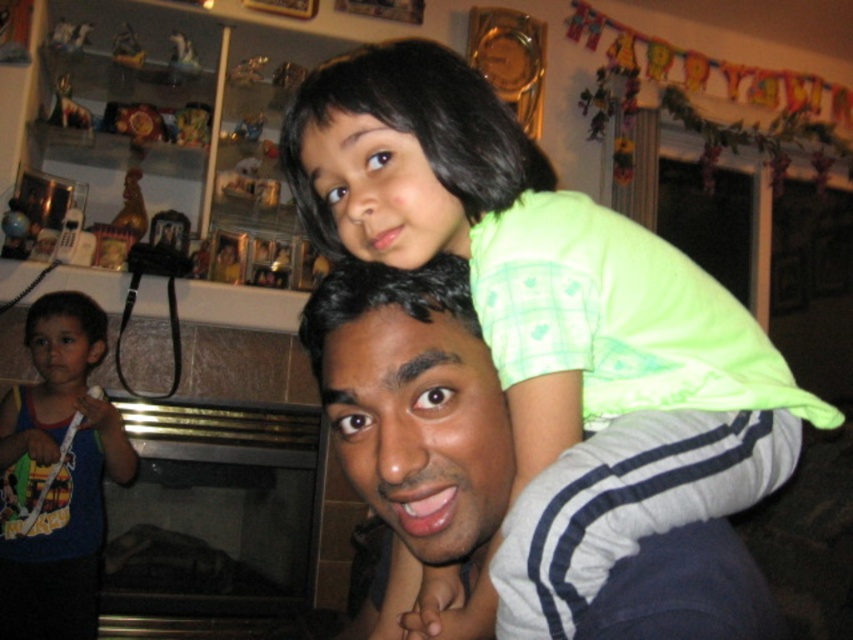
Between point (445, 448) and point (62, 573), which one is positioned behind?

Positioned behind is point (62, 573).

Locate an element on the screen. The image size is (853, 640). gray/white striped shirt at upper center is located at coordinates (413, 403).

Who is more forward, (379, 481) or (62, 524)?

Positioned in front is point (379, 481).

You are a GUI agent. You are given a task and a screenshot of the screen. Output one action in this format:
    pyautogui.click(x=<x>, y=<y>)
    Task: Click on the gray/white striped shirt at upper center
    
    Given the screenshot: What is the action you would take?
    pyautogui.click(x=413, y=403)